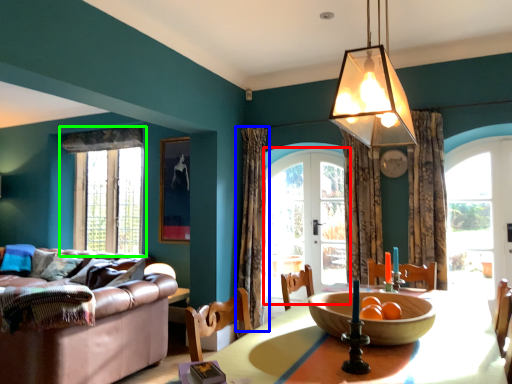
Question: Based on their relative distances, which object is farther from screen door (highlighted by a red box)? Choose from curtain (highlighted by a blue box) and window (highlighted by a green box).

Choices:
 (A) curtain
 (B) window

Answer: (B)